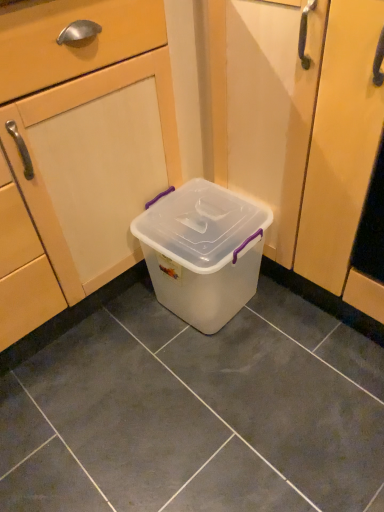
The height and width of the screenshot is (512, 384). What are the coordinates of `transparent plastic storage box at center` in the screenshot? It's located at (203, 251).

The height and width of the screenshot is (512, 384). What do you see at coordinates (203, 251) in the screenshot?
I see `transparent plastic storage box at center` at bounding box center [203, 251].

The image size is (384, 512). What are the coordinates of `transparent plastic storage box at center` in the screenshot? It's located at (203, 251).